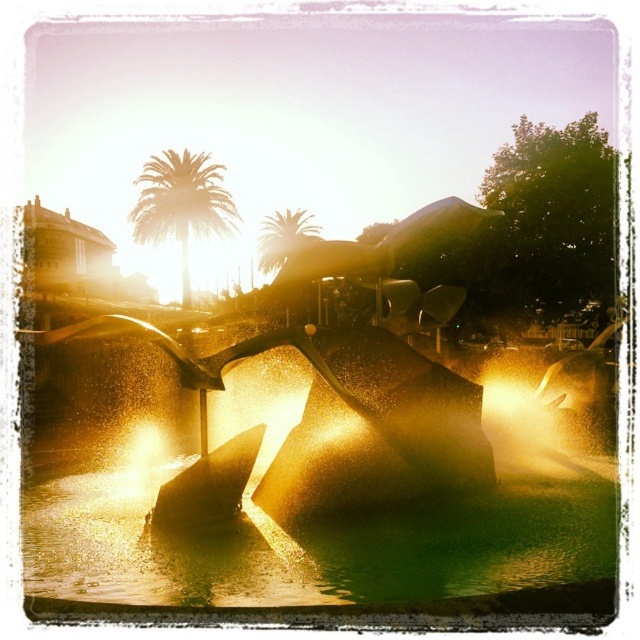
You are standing in front of the fountain and notice two green leafy palm trees in the background. Which palm tree is closer to you, the green leafy palm tree at upper left or the green leafy palm tree at upper center?

The green leafy palm tree at upper left is closer to you because the green leafy palm tree at upper center is behind it.

You are standing at the center of the fountain in the image. You see a point marked at coordinates point (180, 204). Which object in the scene is this point located on?

The point (180, 204) is located on the green leafy palm tree at upper left.